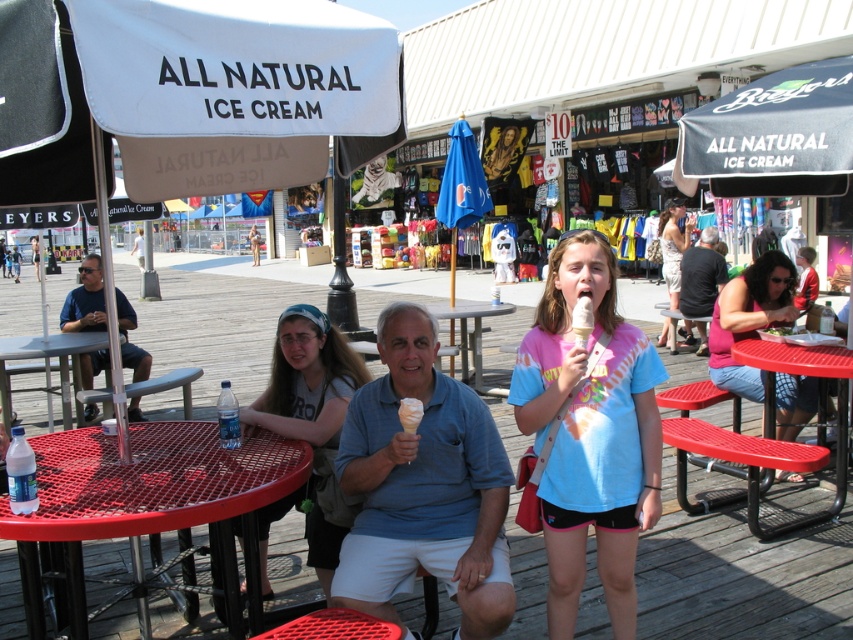
You are standing at the entrance of the boardwalk and see the camouflage dress at center. Where would you find it relative to your current position?

The camouflage dress at center is located at point 0.384 on the x axis and 0.790 on the y axis relative to your current position.

You are a photographer trying to capture both the camouflage dress at center and the white creamy ice cream cone at center in a single shot. Which object should you focus on first to ensure both are in frame?

The camouflage dress at center is taller than the white creamy ice cream cone at center, so you should focus on the camouflage dress at center first to ensure both are in frame.